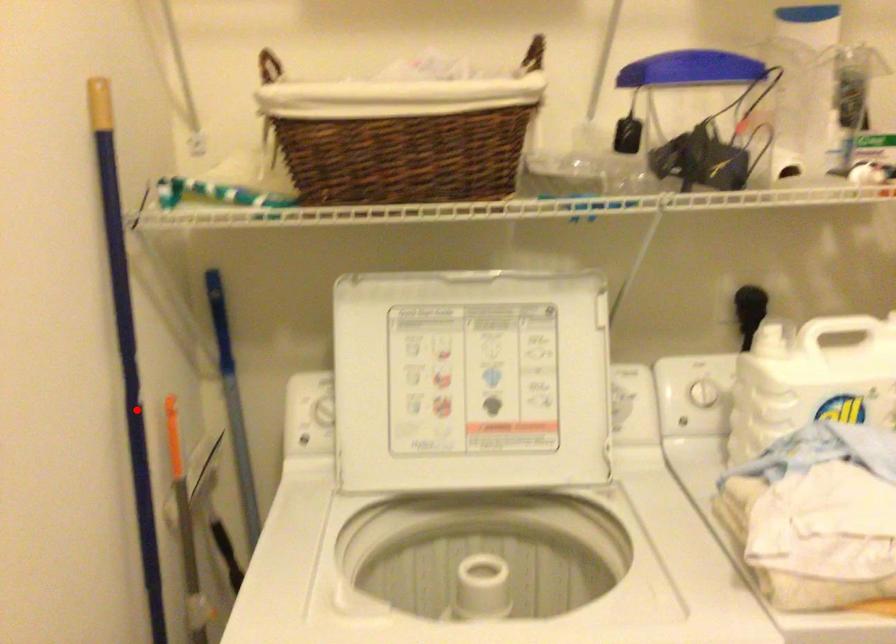
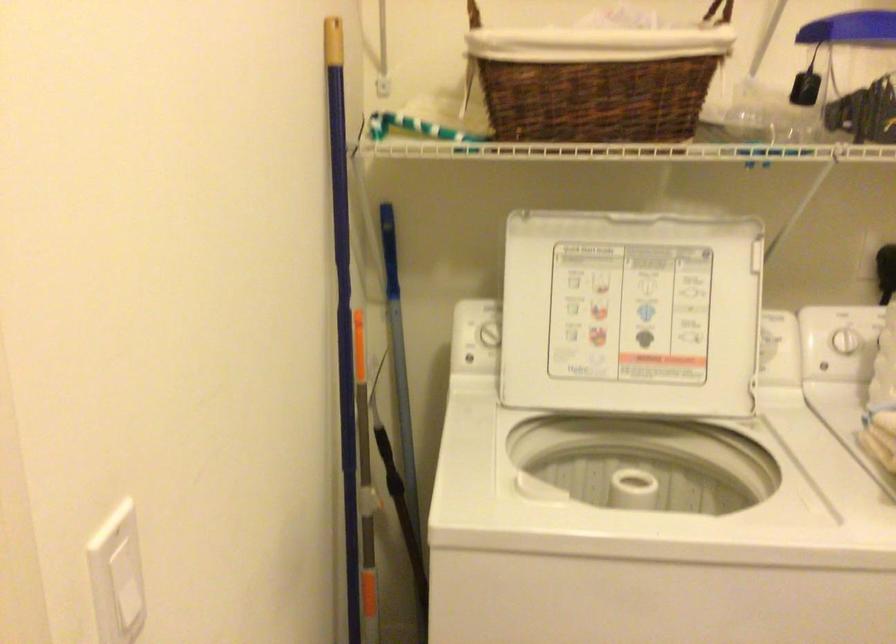
The point at the highlighted location is marked in the first image. Where is the corresponding point in the second image?

(343, 316)